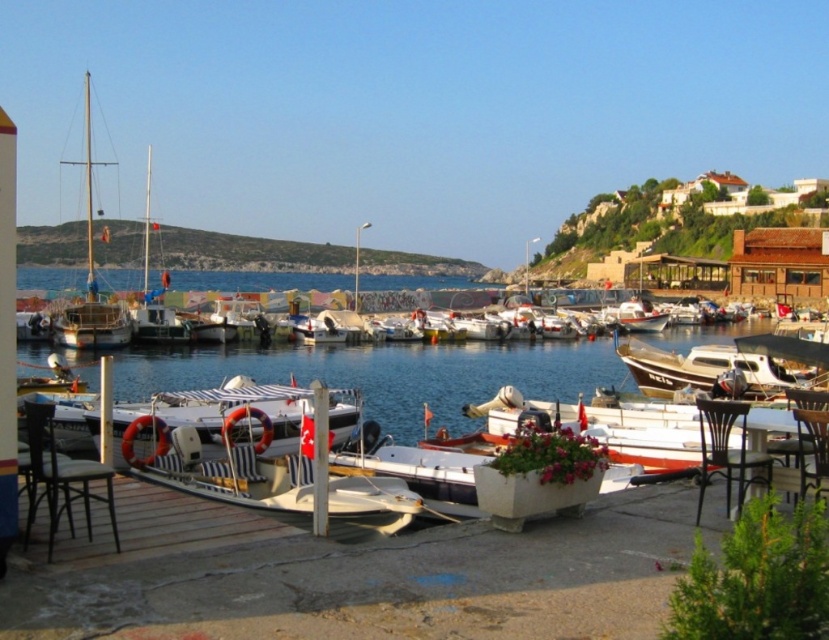
Measure the distance from clear blue water at center to black leather chair at lower left.

They are 177.01 feet apart.

Which is more to the right, clear blue water at center or black leather chair at lower left?

clear blue water at center is more to the right.

Identify the location of clear blue water at center. The image size is (829, 640). (391, 374).

I want to click on clear blue water at center, so click(x=391, y=374).

Is clear blue water at center smaller than wooden chair at lower right?

No.

Between point (687, 346) and point (820, 404), which one is positioned behind?

The point (687, 346) is more distant.

At what (x,y) coordinates should I click in order to perform the action: click on clear blue water at center. Please return your answer as a coordinate pair (x, y). Image resolution: width=829 pixels, height=640 pixels. Looking at the image, I should click on (391, 374).

Does black leather chair at lower left appear on the right side of wooden sailboat at left?

Correct, you'll find black leather chair at lower left to the right of wooden sailboat at left.

Does black leather chair at lower left appear under wooden sailboat at left?

Indeed, black leather chair at lower left is positioned under wooden sailboat at left.

I want to click on black leather chair at lower left, so click(x=61, y=477).

You are a GUI agent. You are given a task and a screenshot of the screen. Output one action in this format:
    pyautogui.click(x=<x>, y=<y>)
    Task: Click on the black leather chair at lower left
    The width and height of the screenshot is (829, 640).
    Given the screenshot: What is the action you would take?
    pyautogui.click(x=61, y=477)